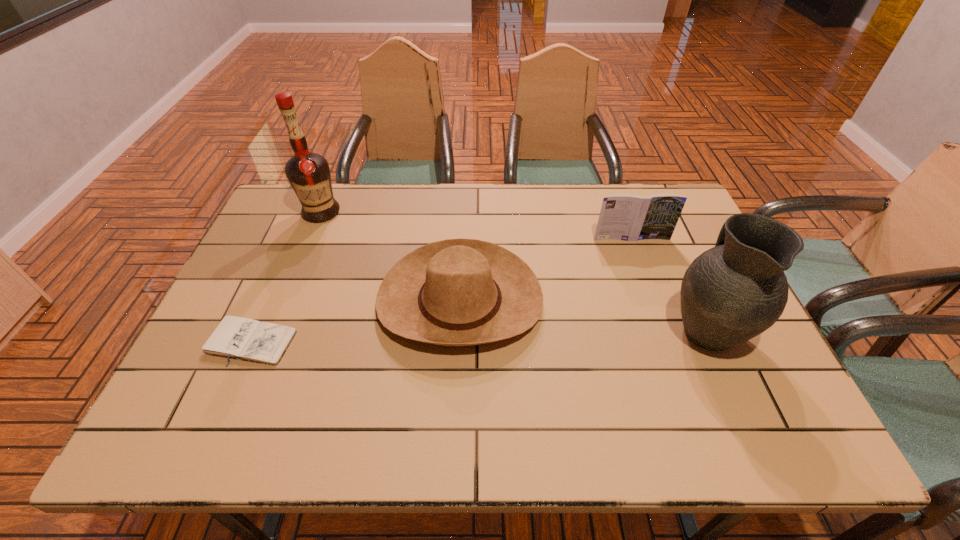
At what (x,y) coordinates should I click in order to perform the action: click on free point at the near edge. Please return your answer as a coordinate pair (x, y). This screenshot has width=960, height=540. Looking at the image, I should click on [x=652, y=427].

In the image, there is a desktop. Find the location of `vacant space at the left edge`. vacant space at the left edge is located at coordinates (305, 234).

This screenshot has width=960, height=540. In order to click on blank space at the far left corner in this screenshot , I will do `click(316, 225)`.

At what (x,y) coordinates should I click in order to perform the action: click on vacant region at the near left corner of the desktop. Please return your answer as a coordinate pair (x, y). Looking at the image, I should click on (155, 438).

The width and height of the screenshot is (960, 540). I want to click on free space between the shortest object and the third object from left to right, so click(x=355, y=321).

Identify the location of vacant area that lies between the shortest object and the third object from right to left. This screenshot has width=960, height=540. (355, 321).

Locate an element on the screen. vacant space that's between the cowboy hat and the tallest object is located at coordinates (391, 256).

Identify the location of blank region between the cowboy hat and the book. This screenshot has width=960, height=540. (545, 270).

Locate an element on the screen. free spot between the shortest object and the cowboy hat is located at coordinates (355, 321).

Identify the location of free space between the book and the tallest object. [476, 226].